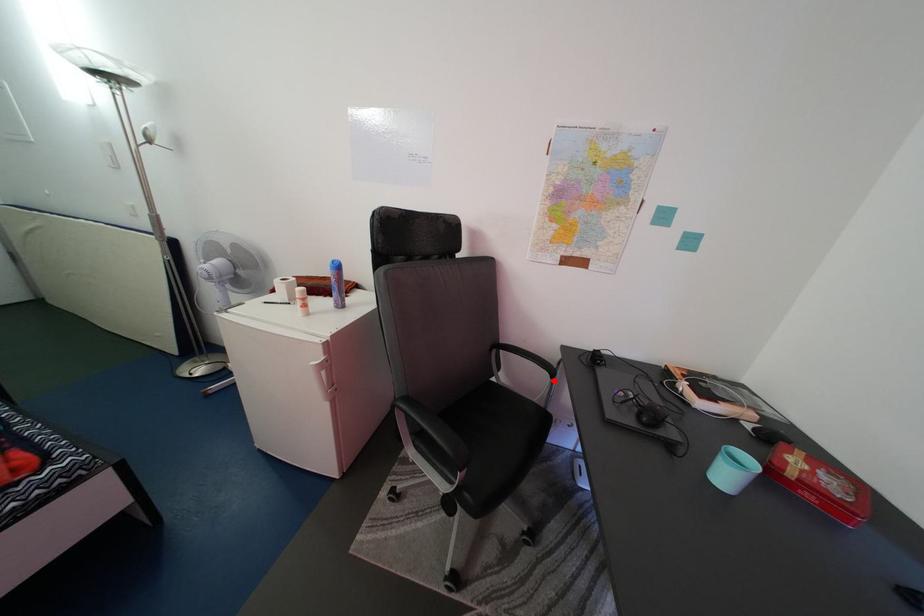
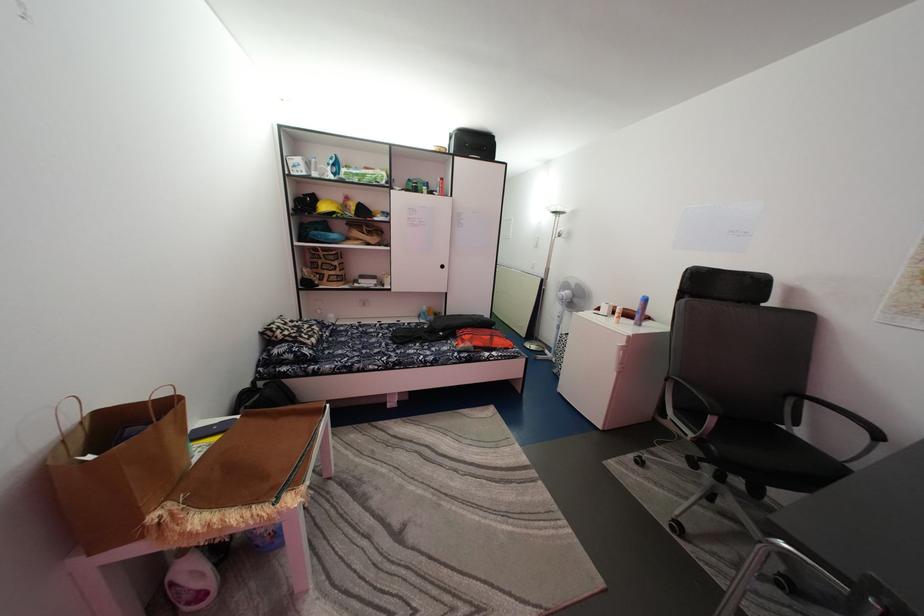
The point at the highlighted location is marked in the first image. Where is the corresponding point in the second image?

(871, 440)